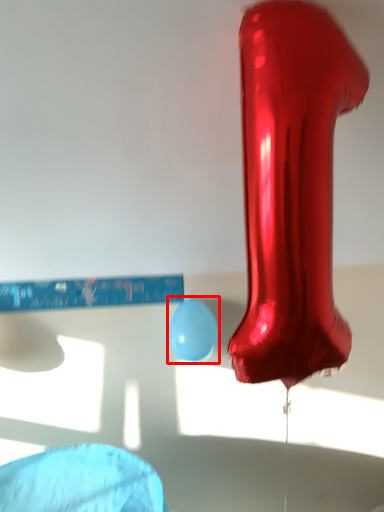
Question: In this image, where is balloon (annotated by the red box) located relative to footwear?

Choices:
 (A) right
 (B) left

Answer: (B)